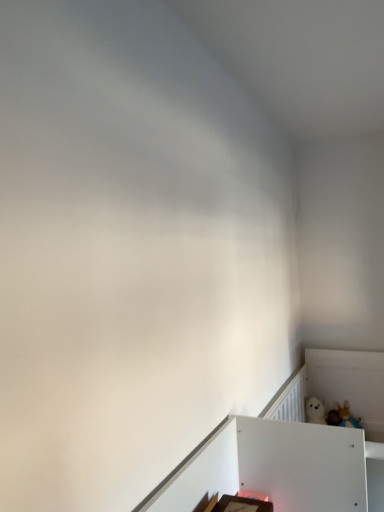
Question: Is white plush bear at lower right positioned behind white matte bed frame at upper right?

Choices:
 (A) yes
 (B) no

Answer: (A)

Question: Can you see white plush bear at lower right touching white matte bed frame at upper right?

Choices:
 (A) no
 (B) yes

Answer: (A)

Question: Is there a large distance between white plush bear at lower right and white matte bed frame at upper right?

Choices:
 (A) yes
 (B) no

Answer: (B)

Question: From a real-world perspective, is white plush bear at lower right over white matte bed frame at upper right?

Choices:
 (A) yes
 (B) no

Answer: (A)

Question: Does white plush bear at lower right have a lesser height compared to white matte bed frame at upper right?

Choices:
 (A) yes
 (B) no

Answer: (A)

Question: From the image's perspective, does white plush bear at lower right appear higher than white matte bed frame at upper right?

Choices:
 (A) no
 (B) yes

Answer: (B)

Question: Is white matte bed frame at upper right outside white plush bear at lower right?

Choices:
 (A) yes
 (B) no

Answer: (A)

Question: Is white plush bear at lower right at the back of white matte bed frame at upper right?

Choices:
 (A) yes
 (B) no

Answer: (B)

Question: Does white matte bed frame at upper right have a greater height compared to white plush bear at lower right?

Choices:
 (A) yes
 (B) no

Answer: (A)

Question: Is white matte bed frame at upper right beside white plush bear at lower right?

Choices:
 (A) no
 (B) yes

Answer: (A)

Question: From the image's perspective, would you say white matte bed frame at upper right is shown under white plush bear at lower right?

Choices:
 (A) yes
 (B) no

Answer: (A)

Question: Is white matte bed frame at upper right far away from white plush bear at lower right?

Choices:
 (A) no
 (B) yes

Answer: (A)

Question: From their relative heights in the image, would you say white matte bed frame at upper right is taller or shorter than white plush bear at lower right?

Choices:
 (A) short
 (B) tall

Answer: (B)